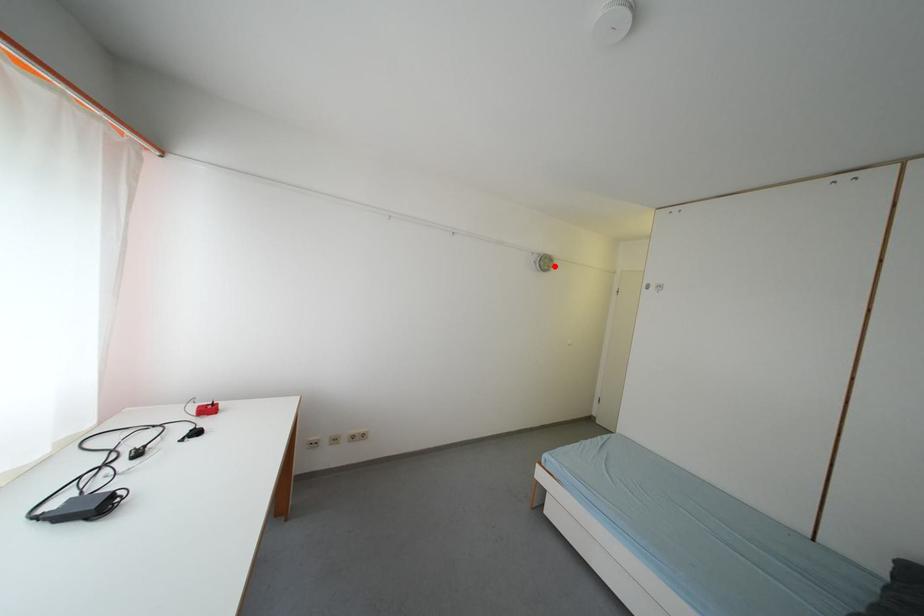
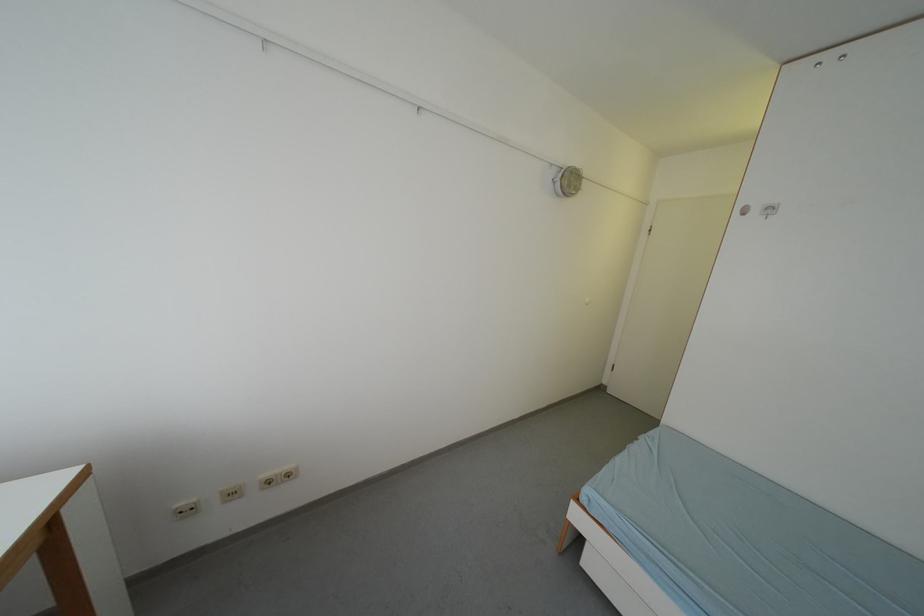
In the second image, find the point that corresponds to the highlighted location in the first image.

(578, 185)